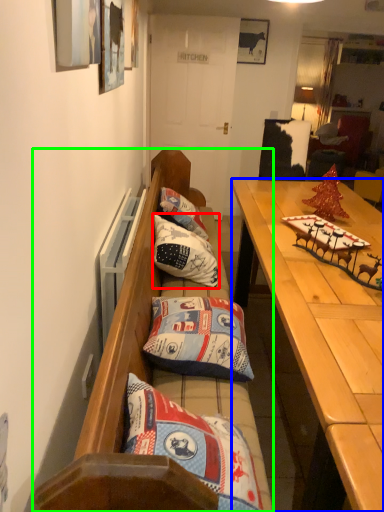
Question: Which is nearer to the pillow (highlighted by a red box)? desk (highlighted by a blue box) or studio couch (highlighted by a green box).

Choices:
 (A) desk
 (B) studio couch

Answer: (B)